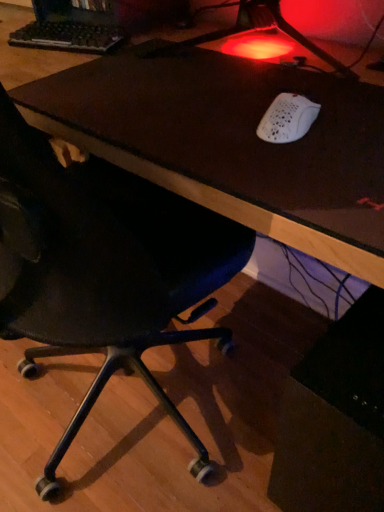
Question: Considering the positions of white matte mouse at upper right and black plastic keyboard at upper left in the image, is white matte mouse at upper right wider or thinner than black plastic keyboard at upper left?

Choices:
 (A) wide
 (B) thin

Answer: (A)

Question: Is white matte mouse at upper right in front of or behind black plastic keyboard at upper left in the image?

Choices:
 (A) front
 (B) behind

Answer: (A)

Question: Which object is the farthest from the brown leather desk at center?

Choices:
 (A) black mesh chair at lower left
 (B) white matte mouse at upper right
 (C) black plastic keyboard at upper left

Answer: (C)

Question: Considering the real-world distances, which object is closest to the white matte mouse at upper right?

Choices:
 (A) black plastic keyboard at upper left
 (B) black mesh chair at lower left
 (C) brown leather desk at center

Answer: (C)